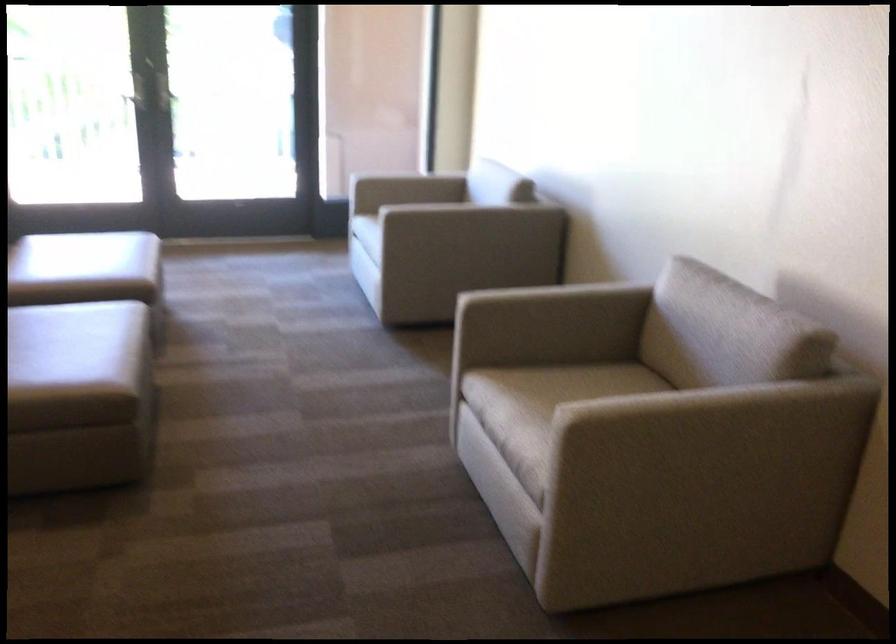
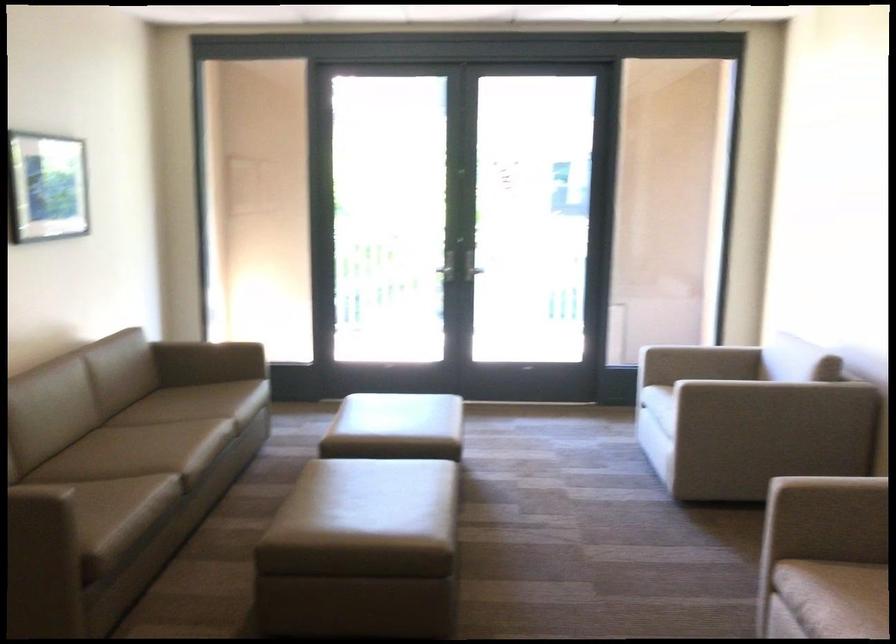
The point at (438, 184) is marked in the first image. Where is the corresponding point in the second image?

(734, 363)